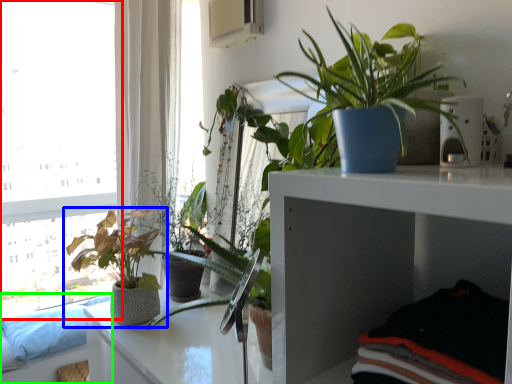
Question: Based on their relative distances, which object is nearer to window (highlighted by a red box)? Choose from houseplant (highlighted by a blue box) and couch (highlighted by a green box).

Choices:
 (A) houseplant
 (B) couch

Answer: (B)